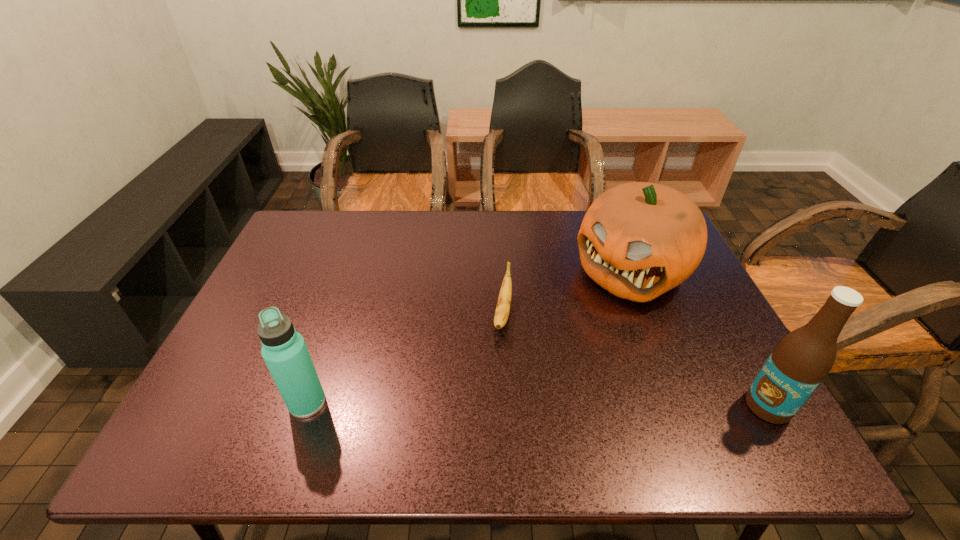
You are a GUI agent. You are given a task and a screenshot of the screen. Output one action in this format:
    pyautogui.click(x=<x>, y=<y>)
    Task: Click on the leftmost object
    The height and width of the screenshot is (540, 960).
    Given the screenshot: What is the action you would take?
    pyautogui.click(x=284, y=350)

Locate an element on the screen. The image size is (960, 540). the tallest object is located at coordinates (799, 363).

Locate an element on the screen. This screenshot has width=960, height=540. the shortest object is located at coordinates (503, 305).

Identify the location of the third object from right to left. (503, 305).

You are a GUI agent. You are given a task and a screenshot of the screen. Output one action in this format:
    pyautogui.click(x=<x>, y=<y>)
    Task: Click on the pumpkin
    The image size is (960, 540).
    Given the screenshot: What is the action you would take?
    pyautogui.click(x=638, y=240)

Locate an element on the screen. vacant region located 0.130m on the left of the leftmost object is located at coordinates (229, 403).

This screenshot has width=960, height=540. In order to click on free space located 0.370m on the back of the beer bottle in this screenshot , I will do `click(697, 279)`.

Find the location of a particular element. Image resolution: width=960 pixels, height=540 pixels. vacant space located 0.060m on the peel of the banana from the top is located at coordinates (x=499, y=361).

Locate an element on the screen. This screenshot has width=960, height=540. vacant space located 0.130m on the peel of the banana from the top is located at coordinates pyautogui.click(x=494, y=385).

At what (x,y) coordinates should I click in order to perform the action: click on vacant space located on the peel of the banana from the top. Please return your answer as a coordinate pair (x, y). The width and height of the screenshot is (960, 540). Looking at the image, I should click on (495, 378).